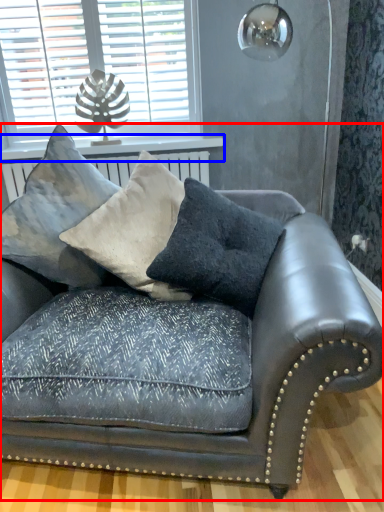
Question: Which of the following is the farthest to the observer, studio couch (highlighted by a red box) or window sill (highlighted by a blue box)?

Choices:
 (A) studio couch
 (B) window sill

Answer: (B)